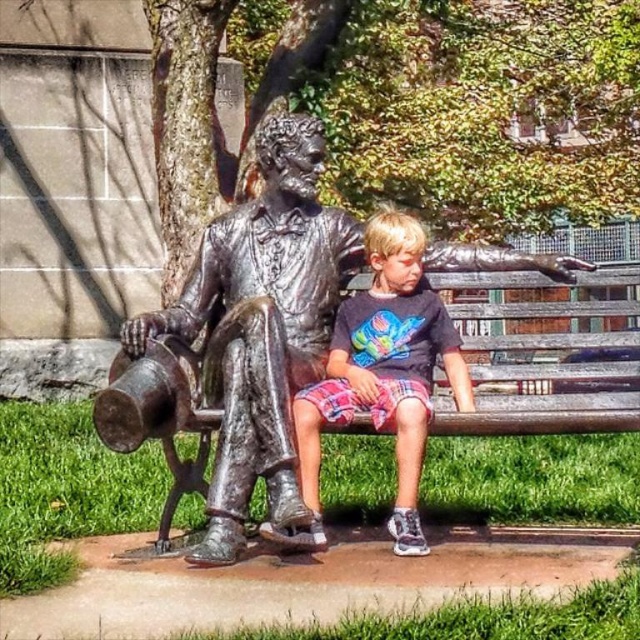
Question: Among these objects, which one is nearest to the camera?

Choices:
 (A) bronze statue at center
 (B) matte black shirt at center

Answer: (A)

Question: Among these points, which one is farthest from the camera?

Choices:
 (A) (320, 419)
 (B) (129, 401)

Answer: (A)

Question: Is bronze statue at center thinner than matte black shirt at center?

Choices:
 (A) no
 (B) yes

Answer: (A)

Question: Is bronze statue at center above matte black shirt at center?

Choices:
 (A) no
 (B) yes

Answer: (B)

Question: Does bronze statue at center have a smaller size compared to matte black shirt at center?

Choices:
 (A) no
 (B) yes

Answer: (A)

Question: Among these objects, which one is nearest to the camera?

Choices:
 (A) matte black shirt at center
 (B) bronze statue at center

Answer: (B)